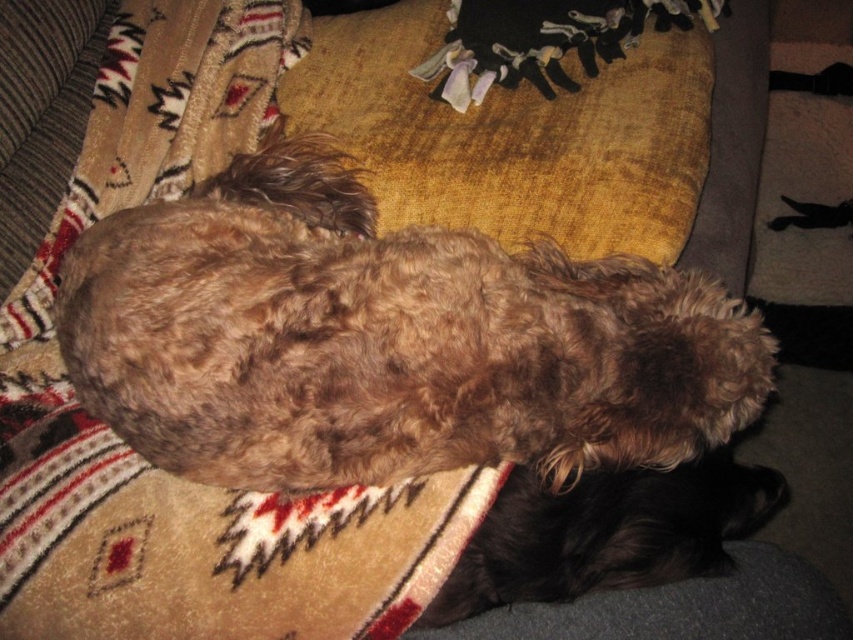
Question: Can you confirm if brown fuzzy dog at center is positioned to the left of brown fuzzy dog at lower right?

Choices:
 (A) yes
 (B) no

Answer: (A)

Question: Which point appears farthest from the camera in this image?

Choices:
 (A) (347, 188)
 (B) (44, 512)

Answer: (A)

Question: Estimate the real-world distances between objects in this image. Which object is farther from the beige woven blanket at upper center?

Choices:
 (A) brown fuzzy dog at center
 (B) brown fuzzy dog at lower right

Answer: (B)

Question: Is brown fuzzy dog at center thinner than brown fuzzy dog at lower right?

Choices:
 (A) no
 (B) yes

Answer: (A)

Question: Is brown fuzzy dog at center wider than beige woven blanket at upper center?

Choices:
 (A) yes
 (B) no

Answer: (A)

Question: Which of these objects is positioned closest to the brown fuzzy dog at center?

Choices:
 (A) beige woven blanket at upper center
 (B) brown fuzzy dog at lower right

Answer: (A)